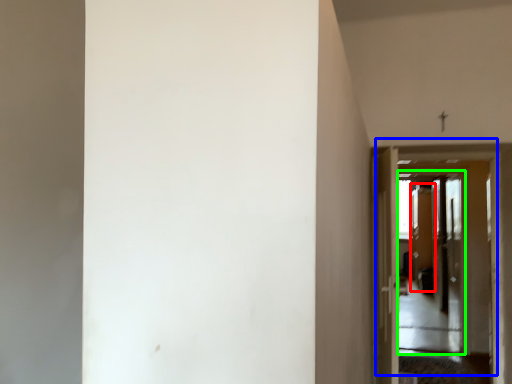
Question: Which object is positioned farthest from screen door (highlighted by a red box)? Select from door (highlighted by a blue box) and screen door (highlighted by a green box).

Choices:
 (A) door
 (B) screen door

Answer: (A)